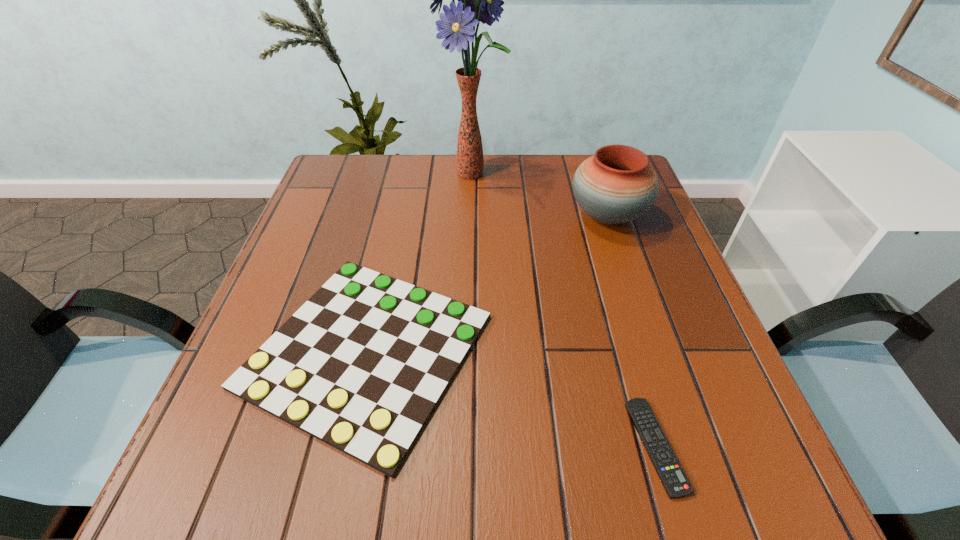
Where is `the tallest object`? This screenshot has width=960, height=540. the tallest object is located at coordinates (479, 0).

At what (x,y) coordinates should I click in order to perform the action: click on pottery. Please return your answer as a coordinate pair (x, y). The image size is (960, 540). Looking at the image, I should click on (616, 185).

This screenshot has width=960, height=540. In order to click on the third tallest object in this screenshot , I will do `click(361, 365)`.

You are a GUI agent. You are given a task and a screenshot of the screen. Output one action in this format:
    pyautogui.click(x=<x>, y=<y>)
    Task: Click on the remote control
    This screenshot has width=960, height=540.
    Given the screenshot: What is the action you would take?
    pyautogui.click(x=671, y=474)

Locate an element on the screen. free location located 0.250m on the front of the flower arrangement is located at coordinates (470, 262).

Identify the location of blank space located 0.310m on the front of the second tallest object. This screenshot has height=540, width=960. (652, 349).

You are a GUI agent. You are given a task and a screenshot of the screen. Output one action in this format:
    pyautogui.click(x=<x>, y=<y>)
    Task: Click on the vacant space located 0.330m on the back of the checkerboard
    This screenshot has height=540, width=960.
    Given the screenshot: What is the action you would take?
    pyautogui.click(x=403, y=183)

Where is `vacant point located 0.090m on the back of the shortest object`? This screenshot has width=960, height=540. vacant point located 0.090m on the back of the shortest object is located at coordinates (631, 356).

Identify the location of flower arrangement that is at the far edge. (479, 0).

You are a GUI agent. You are given a task and a screenshot of the screen. Output one action in this format:
    pyautogui.click(x=<x>, y=<y>)
    Task: Click on the pottery present at the far edge
    The height and width of the screenshot is (540, 960).
    Given the screenshot: What is the action you would take?
    pyautogui.click(x=616, y=185)